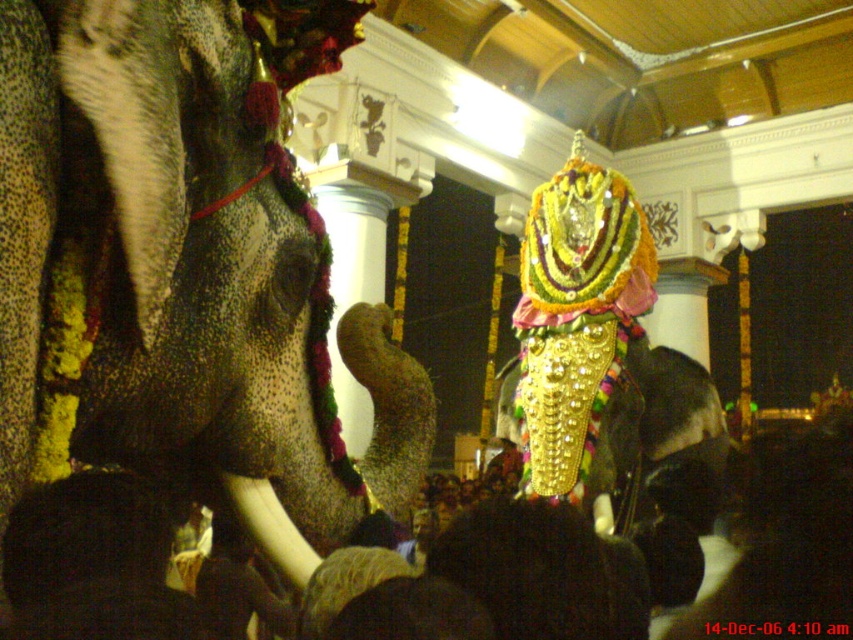
You are an architect designing a new temple layout and need to place a new decorative element. Given the current layout with the polished gold statue at center, where should you position it relative to the statue to maintain symmetry?

To maintain symmetry, the new decorative element should be placed at the mirror image coordinates of the polished gold statue at center. Since the statue is at point (184, 260), the symmetrical position would be at point (666, 378).

You are a photographer trying to capture the two points in the image. Which point, point (241, 296) or point (287, 580), would appear larger in your photo?

Point (241, 296) is closer to the camera than point (287, 580), so it would appear larger in the photo.